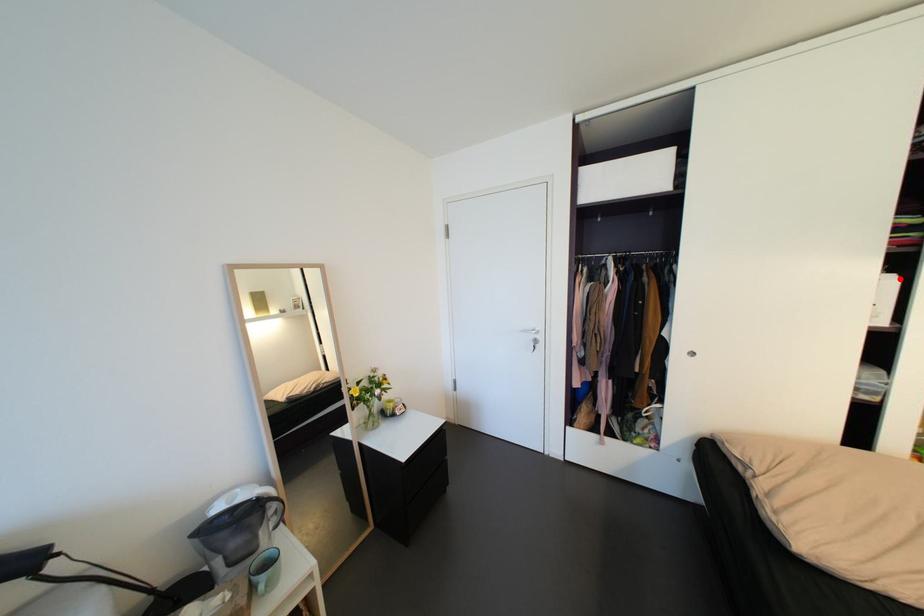
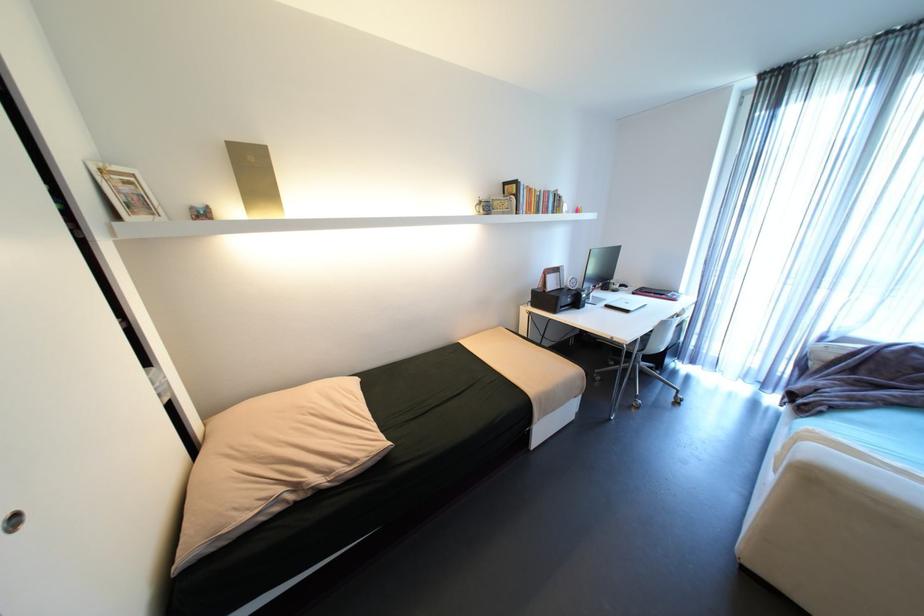
Question: I am providing you with two images of the same scene from different viewpoints. A red point is marked on the first image. Can you still see the location of the red point in image 2?

Choices:
 (A) Yes
 (B) No

Answer: (B)